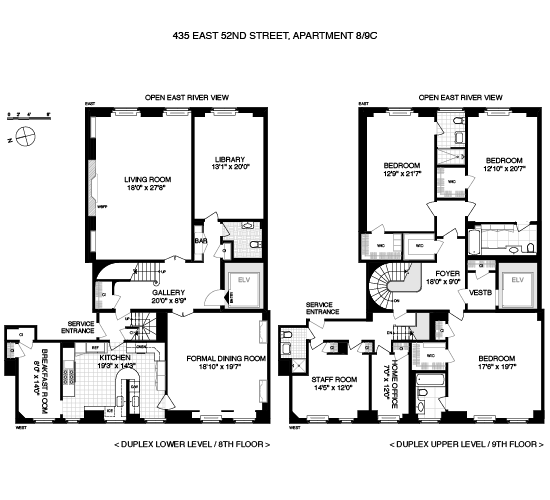
Where is `library area`? The height and width of the screenshot is (500, 550). library area is located at coordinates (209, 171).